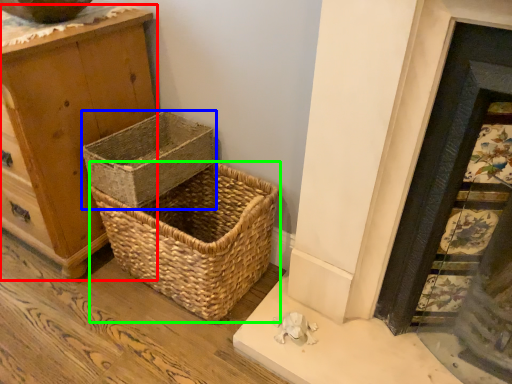
Question: Which object is the closest to the chest of drawers (highlighted by a red box)? Choose among these: picnic basket (highlighted by a blue box) or picnic basket (highlighted by a green box).

Choices:
 (A) picnic basket
 (B) picnic basket

Answer: (A)